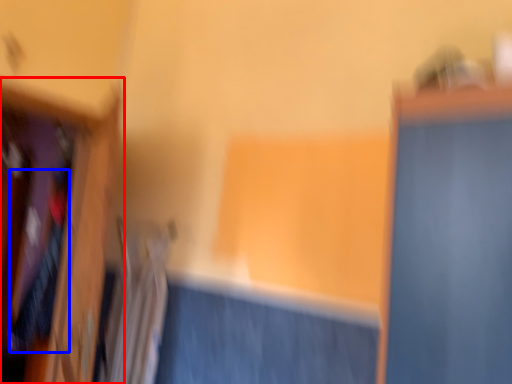
Question: Which object appears farthest to the camera in this image, furniture (highlighted by a red box) or clothing (highlighted by a blue box)?

Choices:
 (A) furniture
 (B) clothing

Answer: (B)